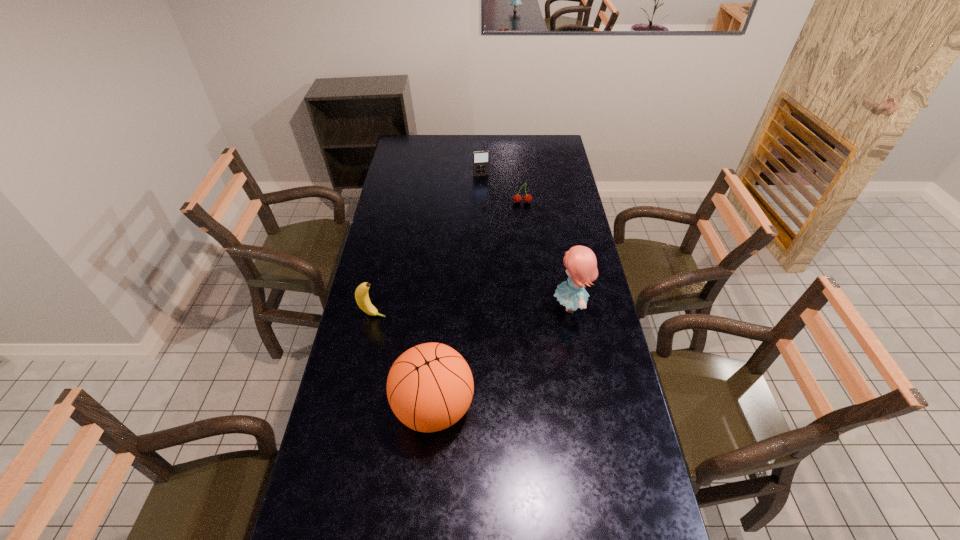
You are a GUI agent. You are given a task and a screenshot of the screen. Output one action in this format:
    pyautogui.click(x=<x>, y=<y>)
    Task: Click on the vacant spot on the desktop that is between the fourth shortest object and the doll and is positioned on the surface of the shortest object
    This screenshot has height=540, width=960.
    Given the screenshot: What is the action you would take?
    tap(524, 341)

Locate an element on the screen. vacant space on the desktop that is between the basketball and the doll and is positioned from the stem of the leftmost object is located at coordinates (521, 342).

The width and height of the screenshot is (960, 540). Find the location of `vacant space on the desktop that is between the second tallest object and the rightmost object and is positioned on the front-facing side of the iPod`. vacant space on the desktop that is between the second tallest object and the rightmost object and is positioned on the front-facing side of the iPod is located at coordinates (525, 340).